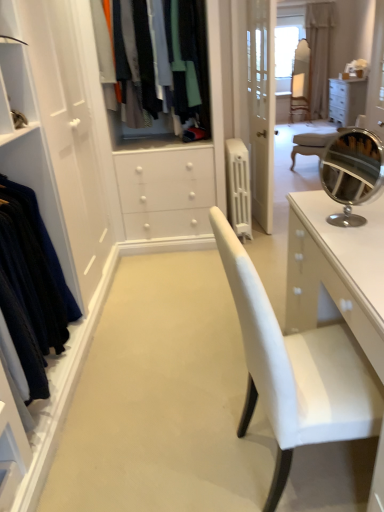
Question: Is white plastic radiator at center inside or outside of velvet dark blue dress at left, which is counted as the 1th clothing, starting from the front?

Choices:
 (A) inside
 (B) outside

Answer: (B)

Question: In the image, is white plastic radiator at center positioned in front of or behind velvet dark blue dress at left, arranged as the second clothing when viewed from the right?

Choices:
 (A) behind
 (B) front

Answer: (A)

Question: Which object is positioned closest to the beige fabric curtain at upper right?

Choices:
 (A) light beige fabric armchair at center
 (B) white plastic radiator at center
 (C) velvet dark blue dress at left, arranged as the second clothing when viewed from the right
 (D) matte fabric clothes at center, which ranks as the second clothing in bottom-to-top order

Answer: (A)

Question: Based on their relative distances, which object is nearer to the velvet dark blue dress at left, which is the 1th clothing from bottom to top?

Choices:
 (A) matte fabric clothes at center, positioned as the 1th clothing in back-to-front order
 (B) beige fabric curtain at upper right
 (C) light beige fabric armchair at center
 (D) white plastic radiator at center

Answer: (A)